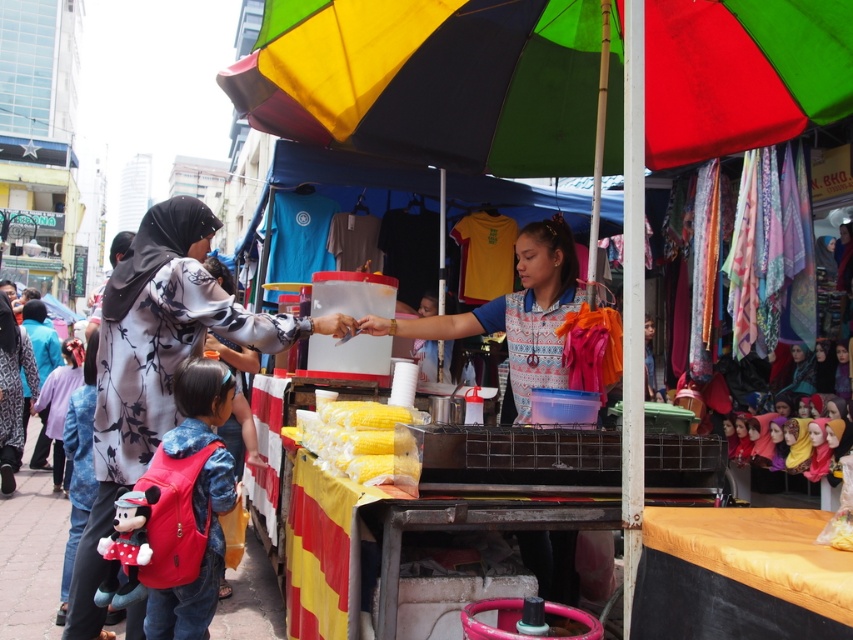
You are a delivery person with a 2 meter long box. You need to place the box between the rainbow fabric umbrella at center and the yellow matte corn at center. Will the box fit between them?

The distance between the rainbow fabric umbrella at center and the yellow matte corn at center is 2.01 meters. Since the box is 2 meters long, it will fit with a small amount of space remaining.

You are a customer at the food stall. You want to buy the yellow matte corn at center. The vendor is under the rainbow fabric umbrella at center. To reach the corn, do you need to walk around the umbrella?

The rainbow fabric umbrella at center is larger in size than yellow matte corn at center. Since the umbrella is larger, it might block direct access to the corn. You would need to move around the umbrella to reach the yellow matte corn at center.